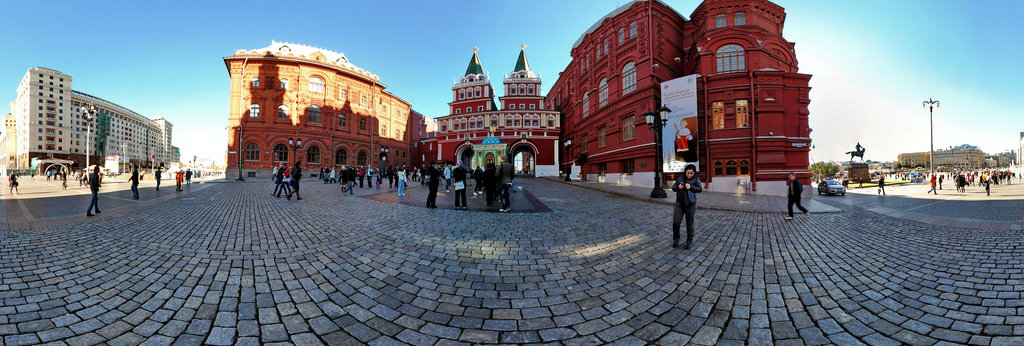
You are a GUI agent. You are given a task and a screenshot of the screen. Output one action in this format:
    pyautogui.click(x=<x>, y=<y>)
    Task: Click on the statue
    This screenshot has height=346, width=1024.
    Given the screenshot: What is the action you would take?
    pyautogui.click(x=853, y=152)